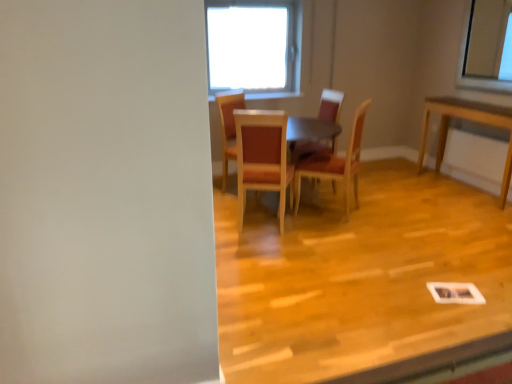
Question: From a real-world perspective, is wooden chair at center, which ranks as the third chair in right-to-left order, located beneath wooden floor at center?

Choices:
 (A) yes
 (B) no

Answer: (B)

Question: Does wooden chair at center, which ranks as the third chair in right-to-left order, have a larger size compared to wooden floor at center?

Choices:
 (A) yes
 (B) no

Answer: (B)

Question: Is wooden chair at center, positioned as the second chair in left-to-right order, thinner than wooden floor at center?

Choices:
 (A) no
 (B) yes

Answer: (B)

Question: From the image's perspective, does wooden chair at center, which ranks as the third chair in right-to-left order, appear lower than wooden floor at center?

Choices:
 (A) no
 (B) yes

Answer: (A)

Question: Does wooden chair at center, which ranks as the third chair in right-to-left order, come behind wooden floor at center?

Choices:
 (A) yes
 (B) no

Answer: (A)

Question: Looking at the image, does wooden chair at center, marked as the first chair in a left-to-right arrangement, seem bigger or smaller compared to wooden chair at center, which appears as the third chair when viewed from the left?

Choices:
 (A) small
 (B) big

Answer: (A)

Question: From their relative heights in the image, would you say wooden chair at center, marked as the first chair in a left-to-right arrangement, is taller or shorter than wooden chair at center, which appears as the third chair when viewed from the left?

Choices:
 (A) tall
 (B) short

Answer: (B)

Question: Is wooden chair at center, acting as the fourth chair starting from the right, situated inside wooden chair at center, which appears as the third chair when viewed from the left, or outside?

Choices:
 (A) outside
 (B) inside

Answer: (A)

Question: Does point (226, 127) appear closer or farther from the camera than point (313, 144)?

Choices:
 (A) closer
 (B) farther

Answer: (A)

Question: In the image, is wooden chair at center, the fourth chair when ordered from left to right, positioned in front of or behind wooden table at center?

Choices:
 (A) behind
 (B) front

Answer: (B)

Question: Is wooden chair at center, the fourth chair when ordered from left to right, taller or shorter than wooden table at center?

Choices:
 (A) short
 (B) tall

Answer: (B)

Question: Choose the correct answer: Is wooden chair at center, the fourth chair when ordered from left to right, inside wooden table at center or outside it?

Choices:
 (A) inside
 (B) outside

Answer: (A)

Question: In the image, is wooden chair at center, the fourth chair when ordered from left to right, on the left side or the right side of wooden table at center?

Choices:
 (A) left
 (B) right

Answer: (B)

Question: Which is correct: wooden chair at center, which appears as the third chair when viewed from the left, is inside wooden floor at center, or outside of it?

Choices:
 (A) inside
 (B) outside

Answer: (B)

Question: Considering the positions of wooden chair at center, which appears as the third chair when viewed from the left, and wooden floor at center in the image, is wooden chair at center, which appears as the third chair when viewed from the left, bigger or smaller than wooden floor at center?

Choices:
 (A) small
 (B) big

Answer: (A)